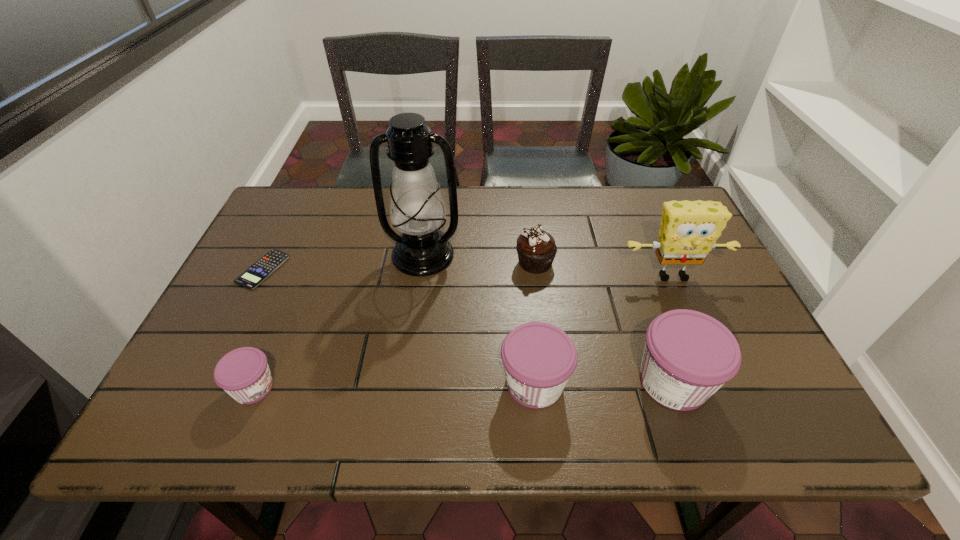
Find the location of a particular element. This screenshot has width=960, height=540. vacant position located on the front label of the second shortest jam is located at coordinates (462, 383).

Find the location of `vacant point located 0.090m on the front label of the second shortest jam`. vacant point located 0.090m on the front label of the second shortest jam is located at coordinates (457, 383).

The image size is (960, 540). Identify the location of vacant space situated 0.080m on the front label of the second shortest jam. (462, 383).

Find the location of `vacant position located on the front label of the rightmost jam`. vacant position located on the front label of the rightmost jam is located at coordinates (761, 381).

Where is `vacant space located on the front of the cupcake`? vacant space located on the front of the cupcake is located at coordinates (547, 359).

Where is `vacant space located 0.350m on the left of the tallest object`? vacant space located 0.350m on the left of the tallest object is located at coordinates (260, 255).

Where is `free location located 0.200m on the face of the second tallest object`? free location located 0.200m on the face of the second tallest object is located at coordinates (707, 355).

The image size is (960, 540). Find the location of `free space located on the back of the shortest object`. free space located on the back of the shortest object is located at coordinates (299, 197).

Image resolution: width=960 pixels, height=540 pixels. In order to click on jam located at the left edge in this screenshot , I will do 243,373.

I want to click on calculator that is at the left edge, so [x=258, y=272].